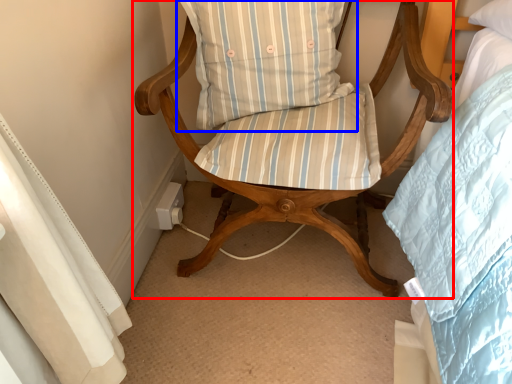
Question: Which of the following is the farthest to the observer, chair (highlighted by a red box) or pillow (highlighted by a blue box)?

Choices:
 (A) chair
 (B) pillow

Answer: (B)